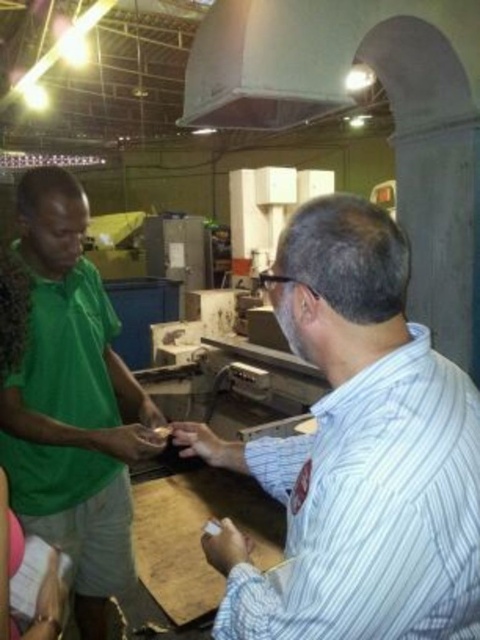
You are a safety inspector in the workshop. You need to ensure that the white striped shirt at right and the green fabric shirt at left are within the required height range for the machinery they are operating. Which person might need to adjust their position to meet the height requirement?

The white striped shirt at right has a lesser height compared to the green fabric shirt at left, so the person wearing the white striped shirt at right might need to adjust their position to meet the height requirement.

You are observing two workers in the workshop. The man in the white striped shirt at right and the man in the green matte shirt at left are standing next to each other. Which worker is shorter in height?

The white striped shirt at right is worn by a shorter worker compared to the green matte shirt at left.

You are a safety inspector in this workshop. You need to ensure that the green matte shirt at left and the green fabric shirt at left are within the required width for safety regulations. Which shirt is wider?

The green matte shirt at left is wider than the green fabric shirt at left according to the description.